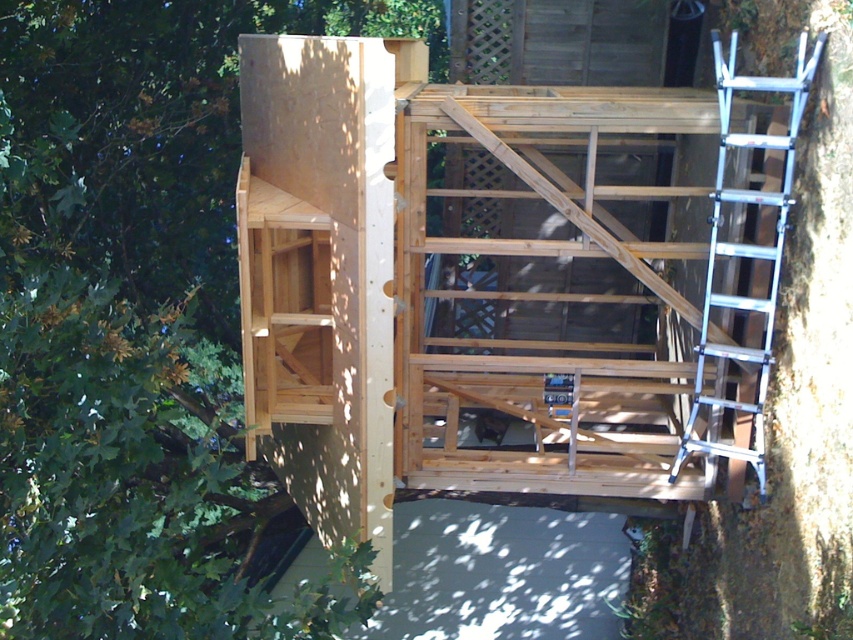
Question: Among these points, which one is farthest from the camera?

Choices:
 (A) (70, 300)
 (B) (779, 232)

Answer: (B)

Question: Where is green matte tree at upper left located in relation to silver metallic ladder at right in the image?

Choices:
 (A) above
 (B) below

Answer: (B)

Question: Does green matte tree at upper left have a larger size compared to silver metallic ladder at right?

Choices:
 (A) no
 (B) yes

Answer: (B)

Question: Which point is farther to the camera?

Choices:
 (A) (32, 35)
 (B) (743, 88)

Answer: (A)

Question: Is green matte tree at upper left positioned in front of silver metallic ladder at right?

Choices:
 (A) yes
 (B) no

Answer: (A)